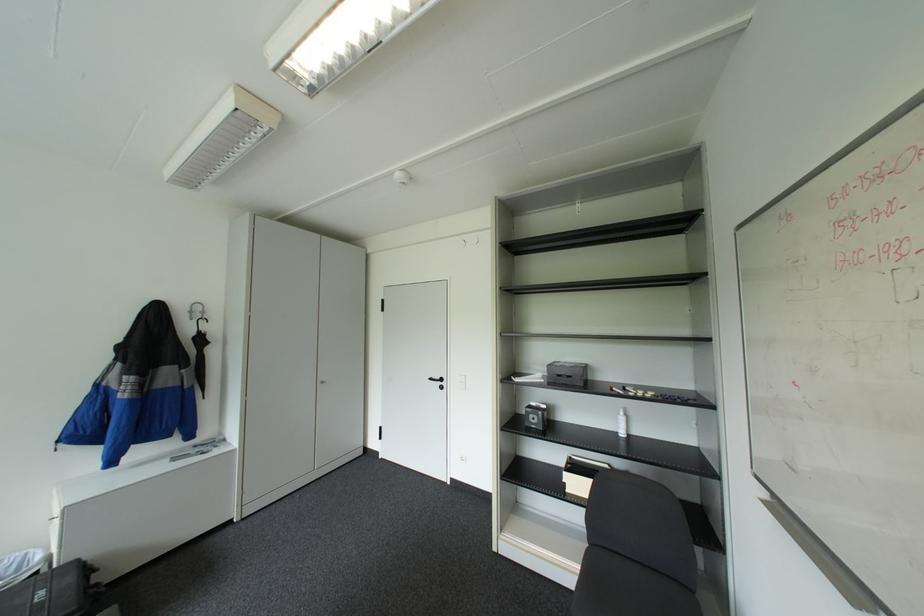
Locate an element on the screen. This screenshot has height=616, width=924. black label printer is located at coordinates (566, 374).